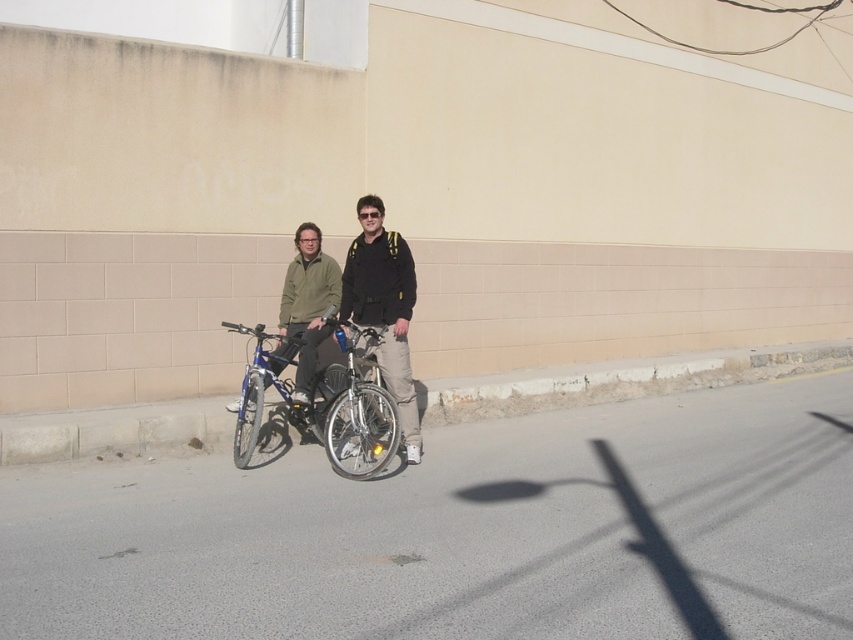
You are a delivery person who needs to locate the matte black jackets at center in the image. Based on the coordinates provided, where would you find them?

The matte black jackets at center are located at coordinates point (384, 308), which would be near the center of the image.

You are a delivery person who needs to determine if the matte black jacket at center can be placed on top of the shiny metallic bicycle at center without falling off. Based on the height difference between them, is this feasible?

The matte black jacket at center has a greater height compared to the shiny metallic bicycle at center, so placing it on top might be unstable and could cause it to fall off due to the jacket being taller than the bicycle.

You are a delivery person who needs to load a package onto the shiny metallic bicycle at center. The package must be placed on the handlebars, which are currently occupied by the matte black jackets at center. Can you place the package there without removing the jackets?

The matte black jackets at center is located above the shiny metallic bicycle at center, so the jackets are likely on the handlebars. Since the handlebars are occupied by the jackets, you cannot place the package there without removing them.